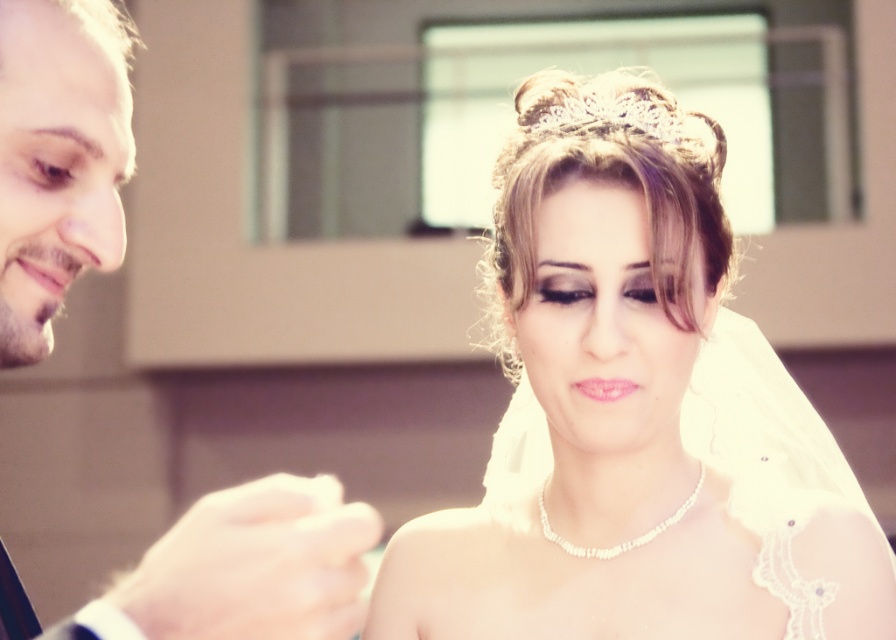
Which is above, smooth skin face at left or clear crystal tiara at upper center?

clear crystal tiara at upper center

Is smooth skin face at left shorter than clear crystal tiara at upper center?

In fact, smooth skin face at left may be taller than clear crystal tiara at upper center.

What do you see at coordinates (58, 160) in the screenshot? I see `smooth skin face at left` at bounding box center [58, 160].

Identify the location of smooth skin face at left. (58, 160).

Is ivory satin veil at upper center taller than smooth skin face at left?

Yes.

Between point (814, 440) and point (289, 577), which one is positioned in front?

Point (289, 577)

I want to click on ivory satin veil at upper center, so click(635, 422).

Which is in front, point (785, 579) or point (672, 104)?

Point (785, 579) is more forward.

Where is `ivory satin veil at upper center`? Image resolution: width=896 pixels, height=640 pixels. ivory satin veil at upper center is located at coordinates 635,422.